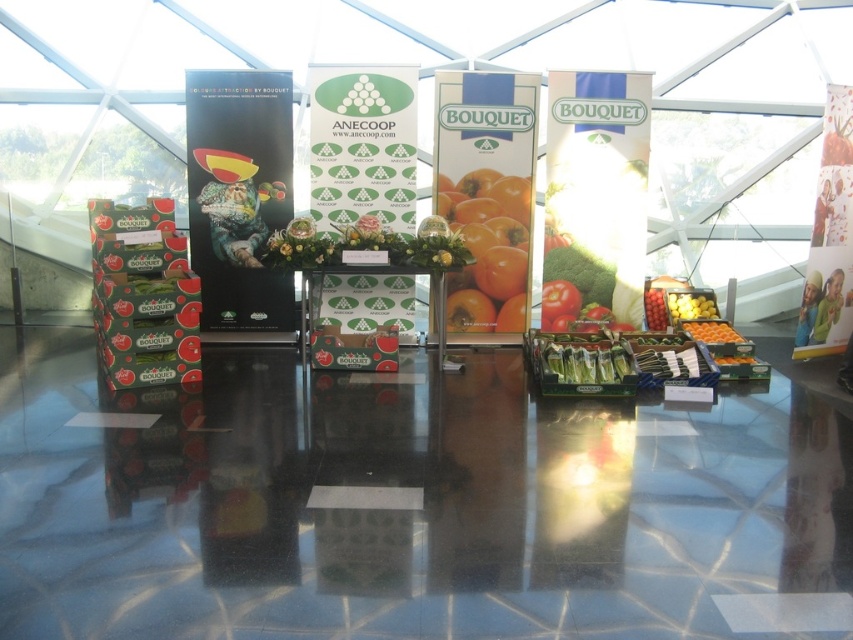
Based on the photo, can you confirm if orange matte at right is bigger than green matte tomato at center?

Yes, orange matte at right is bigger than green matte tomato at center.

Which of these two, orange matte at right or green matte tomato at center, stands shorter?

Standing shorter between the two is orange matte at right.

Which is in front, point (703, 326) or point (666, 316)?

Point (703, 326) is in front.

Find the location of `orange matte at right`. orange matte at right is located at coordinates (712, 332).

Is green glossy asparagus at center smaller than orange matte at right?

Incorrect, green glossy asparagus at center is not smaller in size than orange matte at right.

Which is above, green glossy asparagus at center or orange matte at right?

orange matte at right

At what (x,y) coordinates should I click in order to perform the action: click on green glossy asparagus at center. Please return your answer as a coordinate pair (x, y). Looking at the image, I should click on (587, 362).

Where is `green glossy asparagus at center`? This screenshot has height=640, width=853. green glossy asparagus at center is located at coordinates (587, 362).

Can you confirm if green glossy asparagus at center is wider than green matte tomato at center?

Correct, the width of green glossy asparagus at center exceeds that of green matte tomato at center.

How distant is green glossy asparagus at center from green matte tomato at center?

green glossy asparagus at center is 1.43 meters from green matte tomato at center.

Who is more forward, (x=575, y=342) or (x=660, y=326)?

Point (x=575, y=342) is in front.

Image resolution: width=853 pixels, height=640 pixels. I want to click on green glossy asparagus at center, so click(587, 362).